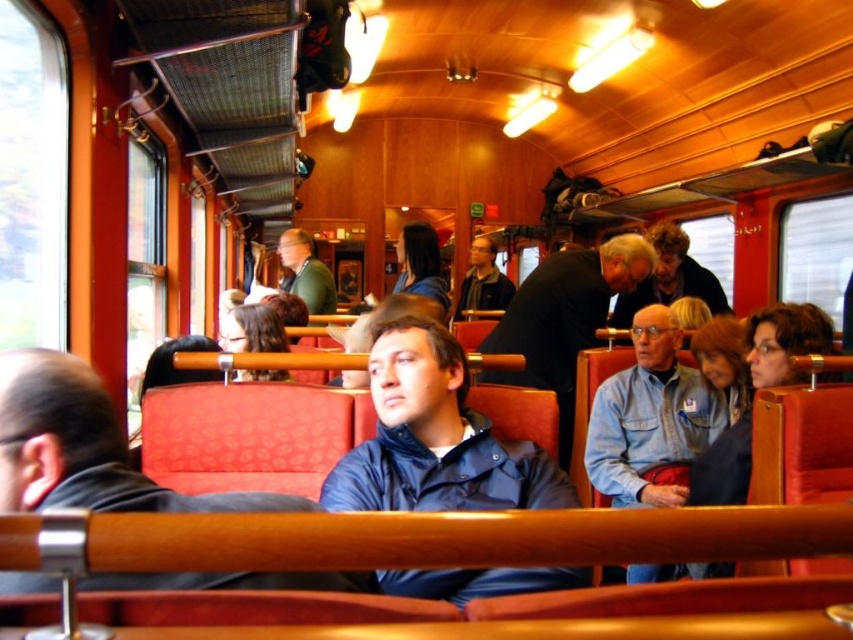
You are a passenger on the train and need to place your blue matte jacket somewhere. The jacket is at point (434,436). Is there enough space to hang it on the wooden handrails between the seats?

The blue matte jacket at center is located at point (434,436). Since the wooden handrails are positioned between each pair of seats, there should be sufficient space to hang the jacket on the handrail nearest to that point.

You are a passenger sitting in the train carriage and notice two jackets hanging from the handrails. Which jacket is to the right when facing the direction of travel? The jackets are the blue matte jacket at center and the green fabric jacket at center.

The blue matte jacket at center is positioned on the right side of the green fabric jacket at center, so when facing the direction of travel, the blue matte jacket at center would be to the right.